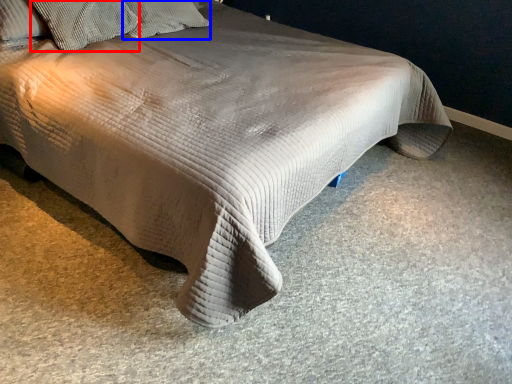
Question: Among these objects, which one is nearest to the camera, pillow (highlighted by a red box) or pillow (highlighted by a blue box)?

Choices:
 (A) pillow
 (B) pillow

Answer: (A)